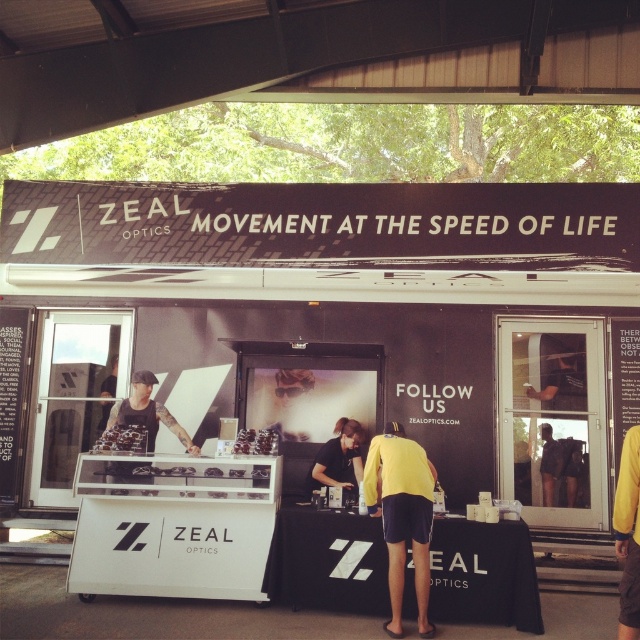
Question: Is yellow matte shirt at center above matte black sunglasses at center?

Choices:
 (A) no
 (B) yes

Answer: (A)

Question: Which object is positioned closest to the yellow matte shirt at center?

Choices:
 (A) white plastic food at center
 (B) black matte shirt at center
 (C) matte black sunglasses at center

Answer: (B)

Question: Which point is closer to the camera?

Choices:
 (A) black matte shirt at center
 (B) matte black sunglasses at center
 (C) white plastic food at center
 (D) yellow matte shirt at center

Answer: (D)

Question: Does black matte shirt at center have a greater width compared to matte black sunglasses at center?

Choices:
 (A) yes
 (B) no

Answer: (A)

Question: Which point is farther from the camera taking this photo?

Choices:
 (A) (214, 474)
 (B) (419, 627)
 (C) (116, 426)
 (D) (333, 442)

Answer: (D)

Question: Is matte black sunglasses at center smaller than white plastic food at center?

Choices:
 (A) no
 (B) yes

Answer: (A)